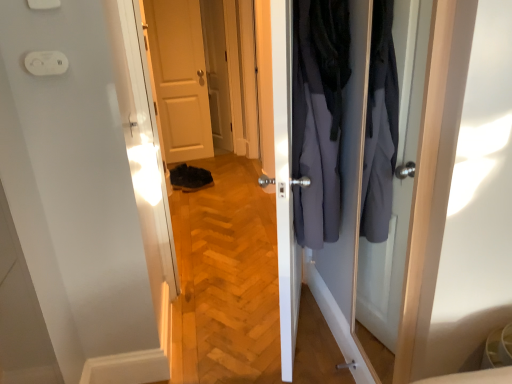
Identify the location of silver metallic door handle at center. (347, 365).

Describe the element at coordinates (42, 4) in the screenshot. I see `white plastic light switch at upper left` at that location.

The width and height of the screenshot is (512, 384). What do you see at coordinates (318, 115) in the screenshot? I see `dark gray fabric coat at center` at bounding box center [318, 115].

Find the location of a particular element. This screenshot has height=384, width=512. black suede shoe at lower center is located at coordinates (190, 178).

Image resolution: width=512 pixels, height=384 pixels. Identify the location of white plastic electric outlet at upper left. (46, 63).

You are a GUI agent. You are given a task and a screenshot of the screen. Output one action in this format:
    pyautogui.click(x=<x>, y=<y>)
    Task: Click on the matte white door at center
    
    Given the screenshot: What is the action you would take?
    pyautogui.click(x=179, y=78)

Identify the location of silver metallic door handle at center. The height and width of the screenshot is (384, 512). (347, 365).

Can you confirm if matte white door at center is taller than white plastic light switch at upper left?

Yes, matte white door at center is taller than white plastic light switch at upper left.

Which of these two, matte white door at center or white plastic light switch at upper left, is wider?

matte white door at center.

How distant is matte white door at center from white plastic light switch at upper left?

matte white door at center and white plastic light switch at upper left are 3.04 meters apart.

Based on the photo, how many degrees apart are the facing directions of black suede shoe at lower center and matte white door at center?

black suede shoe at lower center and matte white door at center are facing 10.6 degrees away from each other.

Who is bigger, black suede shoe at lower center or matte white door at center?

matte white door at center is bigger.

Can you confirm if black suede shoe at lower center is shorter than matte white door at center?

Yes, black suede shoe at lower center is shorter than matte white door at center.

Consider the image. From a real-world perspective, is black suede shoe at lower center under matte white door at center?

Yes, from a real-world perspective, black suede shoe at lower center is beneath matte white door at center.

From the picture: Does matte white door at center have a greater width compared to black suede shoe at lower center?

In fact, matte white door at center might be narrower than black suede shoe at lower center.

Would you say matte white door at center is outside black suede shoe at lower center?

Indeed, matte white door at center is completely outside black suede shoe at lower center.

From the image's perspective, does matte white door at center appear higher than black suede shoe at lower center?

Indeed, from the image's perspective, matte white door at center is shown above black suede shoe at lower center.

Is silver metallic door handle at center facing towards matte white door at center?

No, silver metallic door handle at center is not aimed at matte white door at center.

Is silver metallic door handle at center wider than matte white door at center?

No, silver metallic door handle at center is not wider than matte white door at center.

Is silver metallic door handle at center not near matte white door at center?

That's right, there is a large distance between silver metallic door handle at center and matte white door at center.

How far apart are silver metallic door handle at center and matte white door at center?

They are 3.23 meters apart.

Is white plastic electric outlet at upper left oriented away from matte white door at center?

Yes, white plastic electric outlet at upper left is positioned with its back facing matte white door at center.

Does white plastic electric outlet at upper left have a greater height compared to matte white door at center?

No, white plastic electric outlet at upper left is not taller than matte white door at center.

Considering the points (46, 67) and (183, 20), which point is in front, point (46, 67) or point (183, 20)?

The point (46, 67) is closer to the camera.

Considering the relative sizes of white plastic electric outlet at upper left and matte white door at center in the image provided, is white plastic electric outlet at upper left smaller than matte white door at center?

Correct, white plastic electric outlet at upper left occupies less space than matte white door at center.

What's the angular difference between white plastic electric outlet at upper left and silver metallic door handle at center's facing directions?

91.1 degrees.

Choose the correct answer: Is white plastic electric outlet at upper left inside silver metallic door handle at center or outside it?

white plastic electric outlet at upper left is not enclosed by silver metallic door handle at center.

Can you confirm if white plastic electric outlet at upper left is thinner than silver metallic door handle at center?

Yes.

Find the location of `electric outlet above the silver metallic door handle at center (from the image's perspective)`. electric outlet above the silver metallic door handle at center (from the image's perspective) is located at coordinates (46, 63).

Is dark gray fabric coat at center wider or thinner than white plastic electric outlet at upper left?

Considering their sizes, dark gray fabric coat at center looks broader than white plastic electric outlet at upper left.

How far apart are dark gray fabric coat at center and white plastic electric outlet at upper left?

A distance of 89.56 centimeters exists between dark gray fabric coat at center and white plastic electric outlet at upper left.

Can white plastic electric outlet at upper left be found inside dark gray fabric coat at center?

No, white plastic electric outlet at upper left is not surrounded by dark gray fabric coat at center.

Is dark gray fabric coat at center oriented towards white plastic electric outlet at upper left?

No, dark gray fabric coat at center does not turn towards white plastic electric outlet at upper left.

Find the location of `light switch on the right of matte white door at center`. light switch on the right of matte white door at center is located at coordinates (42, 4).

Find the location of a particular element. The width and height of the screenshot is (512, 384). shoe in front of the matte white door at center is located at coordinates (190, 178).

Estimate the real-world distances between objects in this image. Which object is further from silver metallic door handle at center, white plastic light switch at upper left or white plastic electric outlet at upper left?

white plastic light switch at upper left is positioned further to the anchor silver metallic door handle at center.

Looking at the image, which one is located closer to black suede shoe at lower center, matte white door at center or silver metallic door handle at center?

Based on the image, matte white door at center appears to be nearer to black suede shoe at lower center.

Considering their positions, is dark gray fabric coat at center positioned further to matte white door at center than black suede shoe at lower center?

Based on the image, dark gray fabric coat at center appears to be further to matte white door at center.

Based on their spatial positions, is silver metallic door handle at center or black suede shoe at lower center further from dark gray fabric coat at center?

Among the two, black suede shoe at lower center is located further to dark gray fabric coat at center.

Considering their positions, is white plastic light switch at upper left positioned further to matte white door at center than dark gray fabric coat at center?

The object further to matte white door at center is white plastic light switch at upper left.

Considering their positions, is white plastic electric outlet at upper left positioned closer to white plastic light switch at upper left than dark gray fabric coat at center?

Based on the image, white plastic electric outlet at upper left appears to be nearer to white plastic light switch at upper left.

Which object lies nearer to the anchor point dark gray fabric coat at center, silver metallic door handle at center or white plastic electric outlet at upper left?

white plastic electric outlet at upper left lies closer to dark gray fabric coat at center than the other object.

Based on their spatial positions, is matte white door at center or dark gray fabric coat at center further from white plastic light switch at upper left?

The object further to white plastic light switch at upper left is matte white door at center.

You are a GUI agent. You are given a task and a screenshot of the screen. Output one action in this format:
    pyautogui.click(x=<x>, y=<y>)
    Task: Click on the electric outlet located between dark gray fabric coat at center and matte white door at center in the depth direction
    Image resolution: width=512 pixels, height=384 pixels.
    Given the screenshot: What is the action you would take?
    pyautogui.click(x=46, y=63)

Locate an element on the screen. The image size is (512, 384). door handle between white plastic electric outlet at upper left and black suede shoe at lower center along the z-axis is located at coordinates (347, 365).

Locate an element on the screen. The height and width of the screenshot is (384, 512). electric outlet between white plastic light switch at upper left and black suede shoe at lower center along the z-axis is located at coordinates (46, 63).

Image resolution: width=512 pixels, height=384 pixels. I want to click on door handle located between white plastic light switch at upper left and matte white door at center in the depth direction, so tap(347, 365).